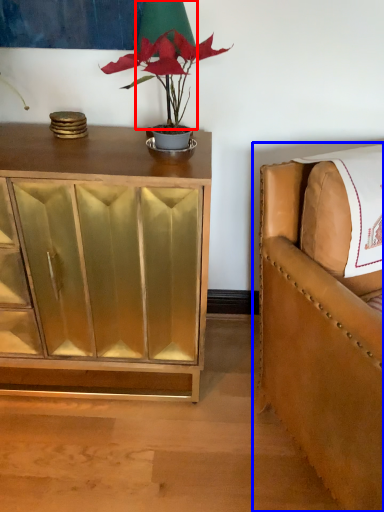
Question: Which of the following is the farthest to the observer, table lamp (highlighted by a red box) or chair (highlighted by a blue box)?

Choices:
 (A) table lamp
 (B) chair

Answer: (A)